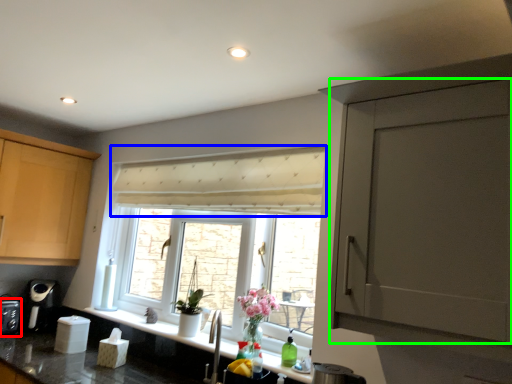
Question: Estimate the real-world distances between objects in this image. Which object is farther from appliance (highlighted by a red box), curtain (highlighted by a blue box) or door (highlighted by a green box)?

Choices:
 (A) curtain
 (B) door

Answer: (B)